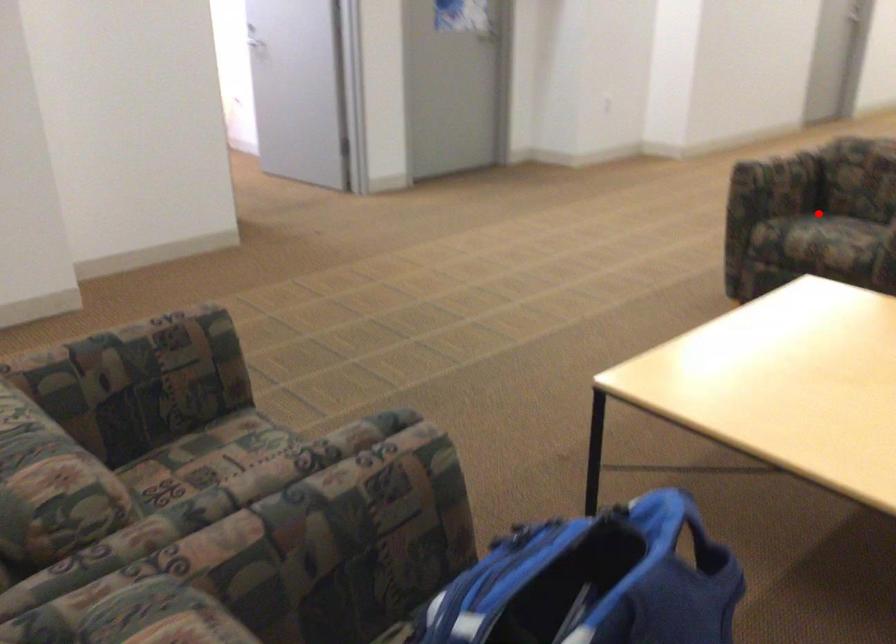
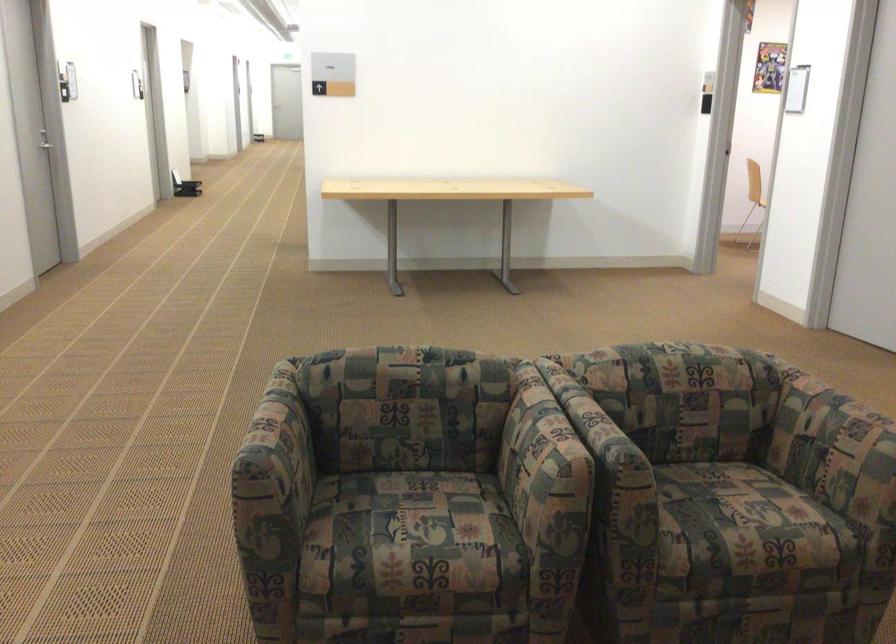
Question: I am providing you with two images of the same scene from different viewpoints. In image1, a red point is highlighted. Considering the same 3D point in image2, which of the following is correct?

Choices:
 (A) It is closer
 (B) It is farther

Answer: (A)